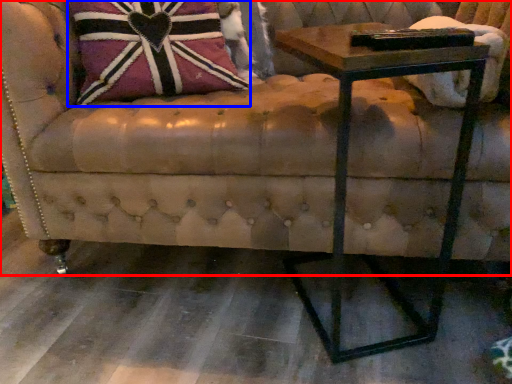
Question: Among these objects, which one is farthest to the camera, studio couch (highlighted by a red box) or throw pillow (highlighted by a blue box)?

Choices:
 (A) studio couch
 (B) throw pillow

Answer: (B)